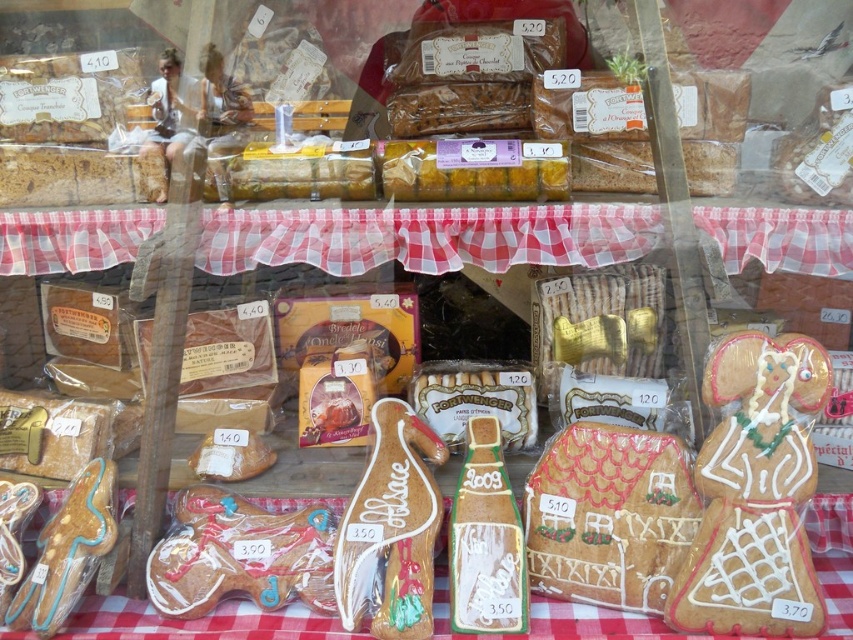
You are a customer at the bakery and want to buy the item located at the center of the display case. Can you tell me what item is at point (608, 515)?

The point (608, 515) corresponds to the white frosted gingerbread house at center.

You are a customer at the bakery and want to buy the white frosted gingerbread house at center and the matte brown gingerbread man at lower left. The store has a rule that items on the same tier must be purchased together. Are both items on the same tier?

The white frosted gingerbread house at center is positioned over the matte brown gingerbread man at lower left, which means they are on different tiers. Therefore, they are not on the same tier, so you don not have to buy them together.